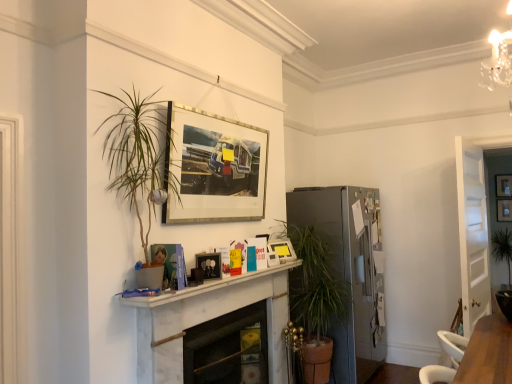
Question: Is white marble fireplace at center, which ranks as the second fireplace in back-to-front order, taller or shorter than satin silver refrigerator at center-right?

Choices:
 (A) short
 (B) tall

Answer: (A)

Question: From a real-world perspective, relative to satin silver refrigerator at center-right, is white marble fireplace at center, arranged as the first fireplace when viewed from the front, vertically above or below?

Choices:
 (A) below
 (B) above

Answer: (A)

Question: Which is farther from the wooden picture frame at upper center, the 1th picture frame viewed from the right?

Choices:
 (A) green leafy plant at center
 (B) white marble fireplace at center, positioned as the second fireplace in front-to-back order
 (C) white plastic swivel chair at lower right
 (D) silver metallic picture frame at upper center, the 2th picture frame in the left-to-right sequence
 (E) matte black picture frame at center, placed as the fourth picture frame when sorted from back to front

Answer: (E)

Question: Estimate the real-world distances between objects in this image. Which object is farther from the white marble mantle at center?

Choices:
 (A) white marble fireplace at center, arranged as the first fireplace when viewed from the back
 (B) white wooden door at right
 (C) white marble fireplace at center, which ranks as the second fireplace in back-to-front order
 (D) matte plastic picture frame at center, the third picture frame viewed from the front
 (E) white plastic swivel chair at lower right

Answer: (B)